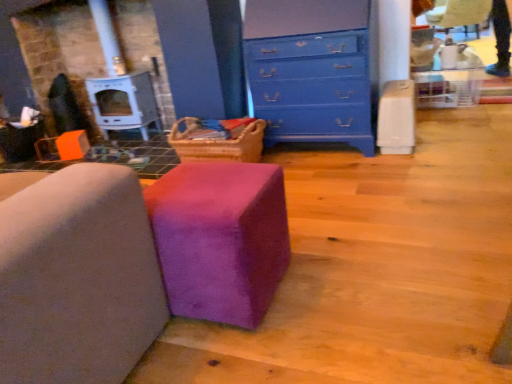
Question: From a real-world perspective, is purple suede ottoman at center, placed as the 1th furniture when sorted from left to right, positioned above or below purple fuzzy ottoman at center, marked as the second furniture in a left-to-right arrangement?

Choices:
 (A) below
 (B) above

Answer: (B)

Question: Considering the relative positions of purple suede ottoman at center, placed as the 1th furniture when sorted from left to right, and purple fuzzy ottoman at center, placed as the first furniture when sorted from right to left, in the image provided, is purple suede ottoman at center, placed as the 1th furniture when sorted from left to right, to the left or to the right of purple fuzzy ottoman at center, placed as the first furniture when sorted from right to left,?

Choices:
 (A) right
 (B) left

Answer: (B)

Question: Which is farther from the purple suede ottoman at center, which is the 2th furniture from right to left?

Choices:
 (A) purple fuzzy ottoman at center, marked as the second furniture in a left-to-right arrangement
 (B) blue painted wood chest of drawers at upper center

Answer: (B)

Question: Which is farther from the blue painted wood chest of drawers at upper center?

Choices:
 (A) purple fuzzy ottoman at center, marked as the second furniture in a left-to-right arrangement
 (B) purple suede ottoman at center, which is the 2th furniture from right to left

Answer: (B)